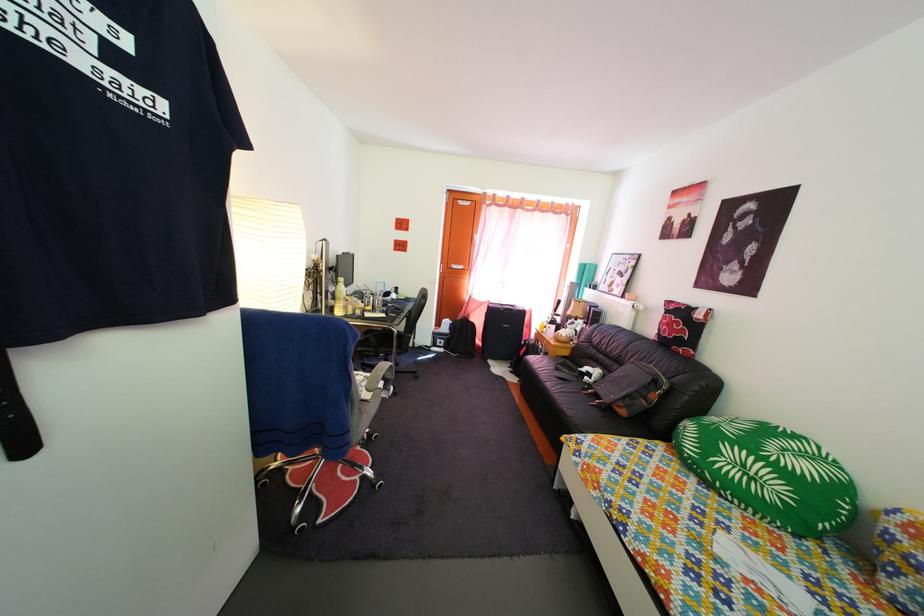
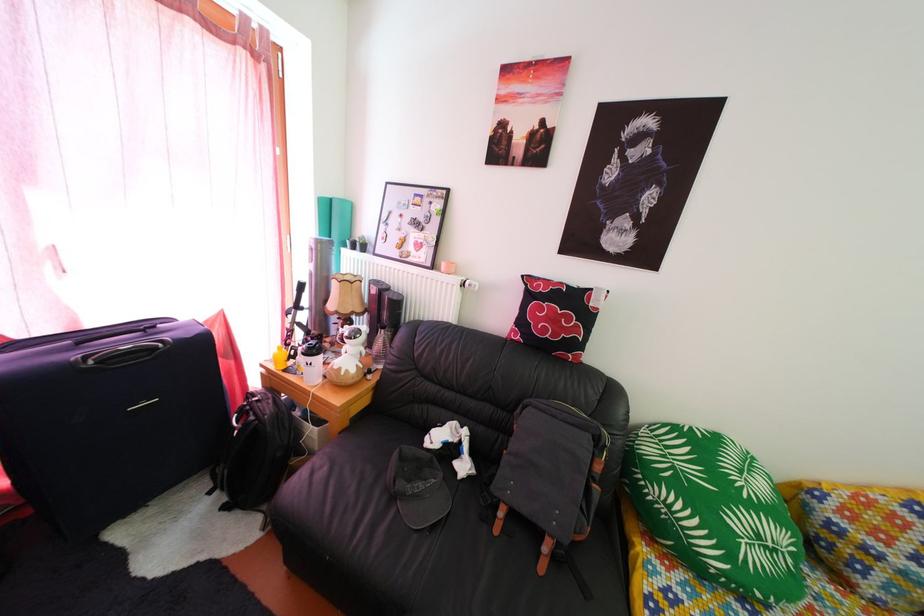
Where in the second image is the point corresponding to [643,309] from the first image?

(464, 282)